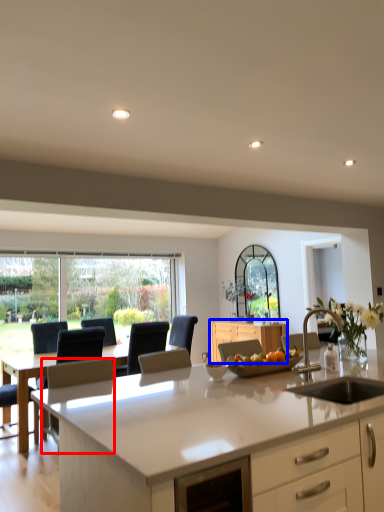
Question: Which object is further to the camera taking this photo, armchair (highlighted by a red box) or cabinetry (highlighted by a blue box)?

Choices:
 (A) armchair
 (B) cabinetry

Answer: (B)